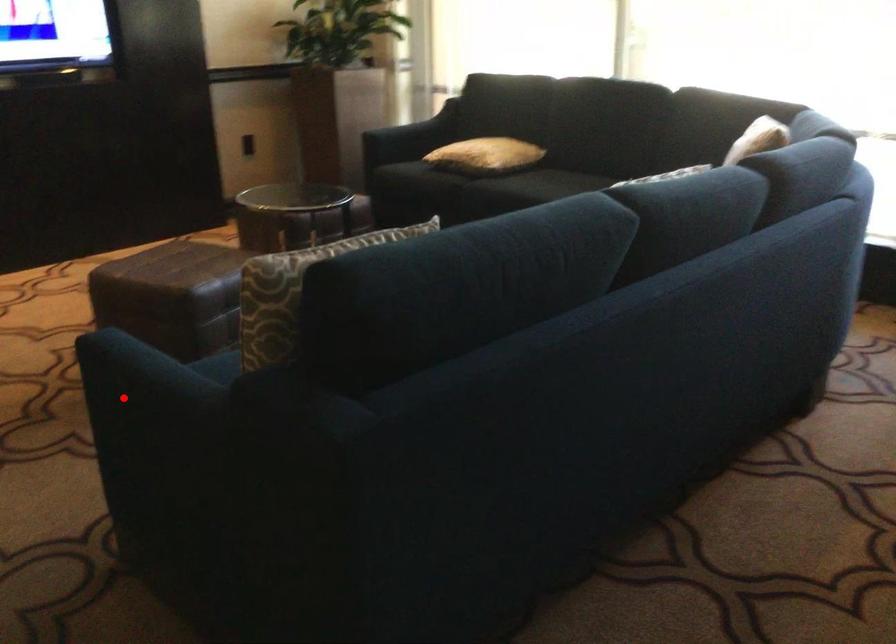
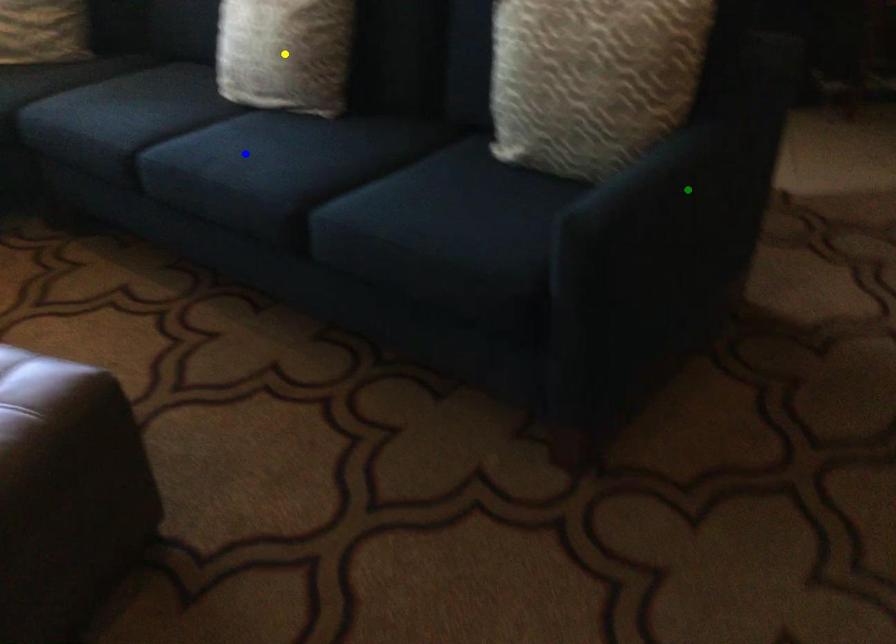
Question: I am providing you with two images of the same scene from different viewpoints. A red point is marked on the first image. You are given multiple points on the second image. Which mark in image 2 goes with the point in image 1?

Choices:
 (A) blue point
 (B) green point
 (C) yellow point

Answer: (B)